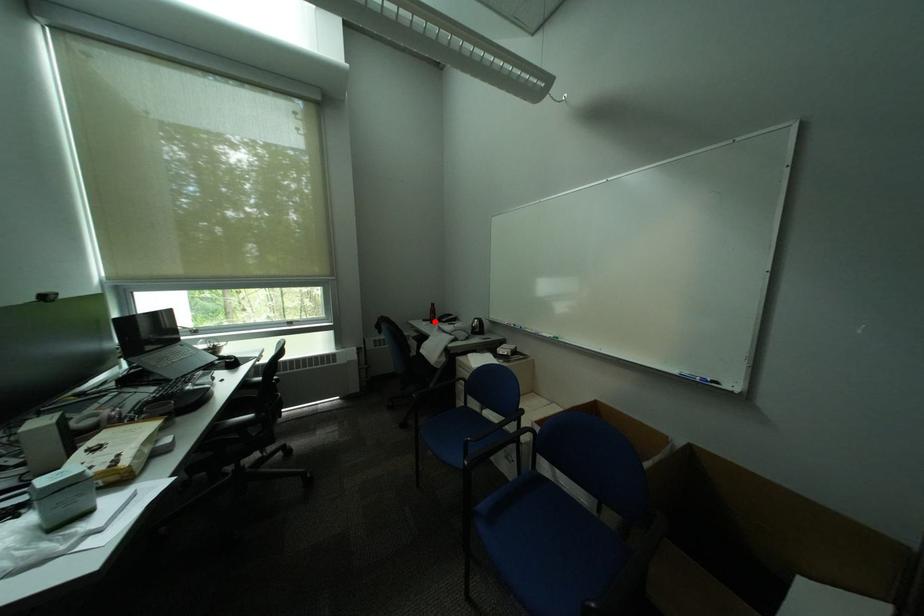
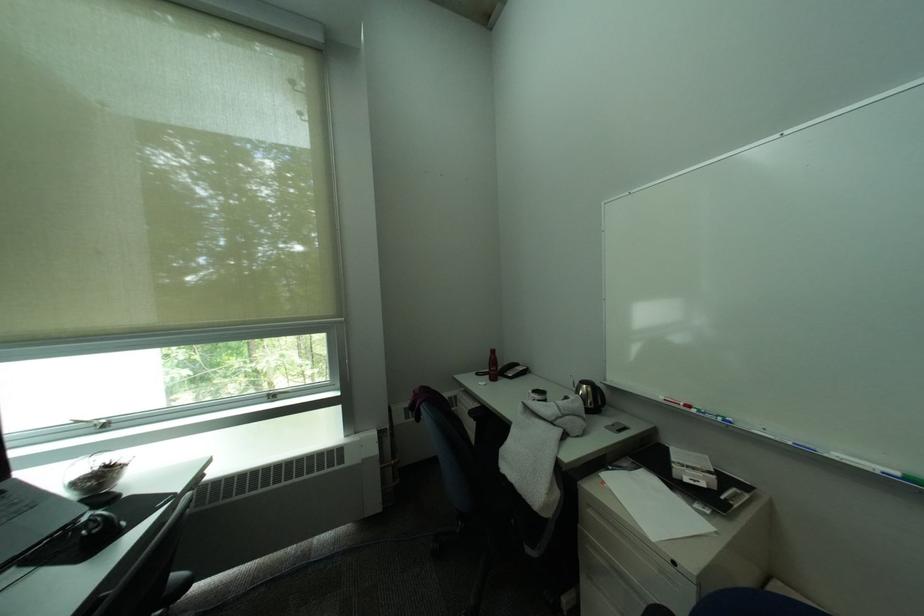
Question: A red point is marked in image1. In image2, is the corresponding 3D point closer to the camera or farther? Reply with the corresponding letter.

Choices:
 (A) The corresponding 3D point is closer.
 (B) The corresponding 3D point is farther.

Answer: (B)